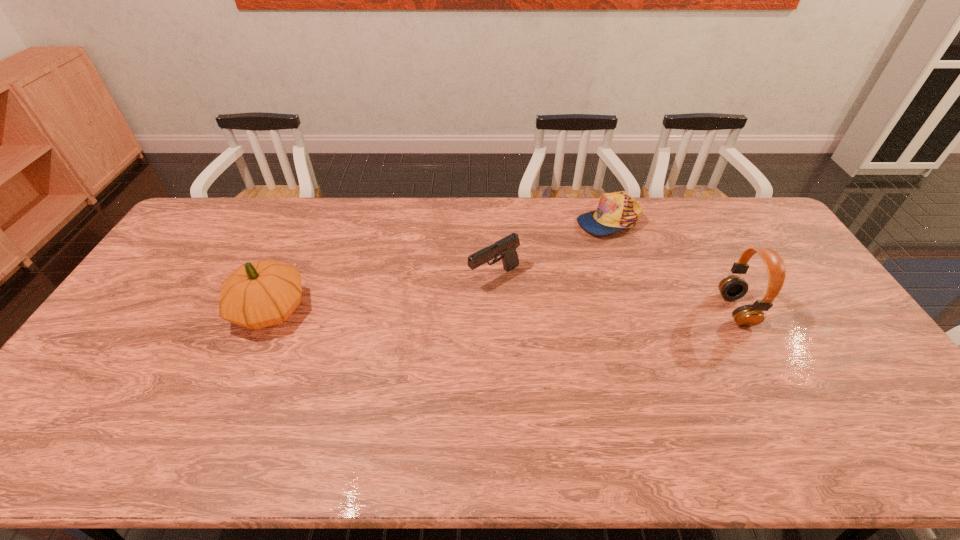
Identify the location of free space between the pistol and the second object from right to left. (551, 248).

At what (x,y) coordinates should I click in order to perform the action: click on free space between the headset and the pistol. Please return your answer as a coordinate pair (x, y). Looking at the image, I should click on (614, 293).

This screenshot has height=540, width=960. Find the location of `vacant space that is in between the second tallest object and the third object from right to left`. vacant space that is in between the second tallest object and the third object from right to left is located at coordinates (382, 293).

This screenshot has height=540, width=960. I want to click on vacant area that lies between the cap and the second tallest object, so click(x=439, y=265).

Where is `object that ranks as the second closest to the second object from left to right`? Image resolution: width=960 pixels, height=540 pixels. object that ranks as the second closest to the second object from left to right is located at coordinates (264, 293).

Identify which object is the nearest to the third object from right to left. Please provide its 2D coordinates. Your answer should be formatted as a tuple, i.e. [(x, y)], where the tuple contains the x and y coordinates of a point satisfying the conditions above.

[(616, 211)]

You are a GUI agent. You are given a task and a screenshot of the screen. Output one action in this format:
    pyautogui.click(x=<x>, y=<y>)
    Task: Click on the vacant region that satisfies the following two spatial constraints: 1. on the front side of the second shortest object; 2. on the ear cups of the headset
    This screenshot has width=960, height=540.
    Given the screenshot: What is the action you would take?
    pyautogui.click(x=495, y=310)